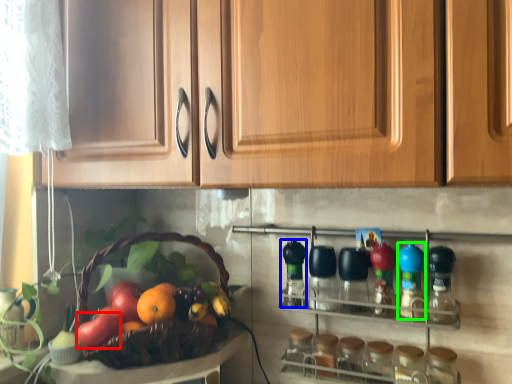
Question: Which is farther away from apple (highlighted by a red box)? bottle (highlighted by a blue box) or bottle (highlighted by a green box)?

Choices:
 (A) bottle
 (B) bottle

Answer: (B)